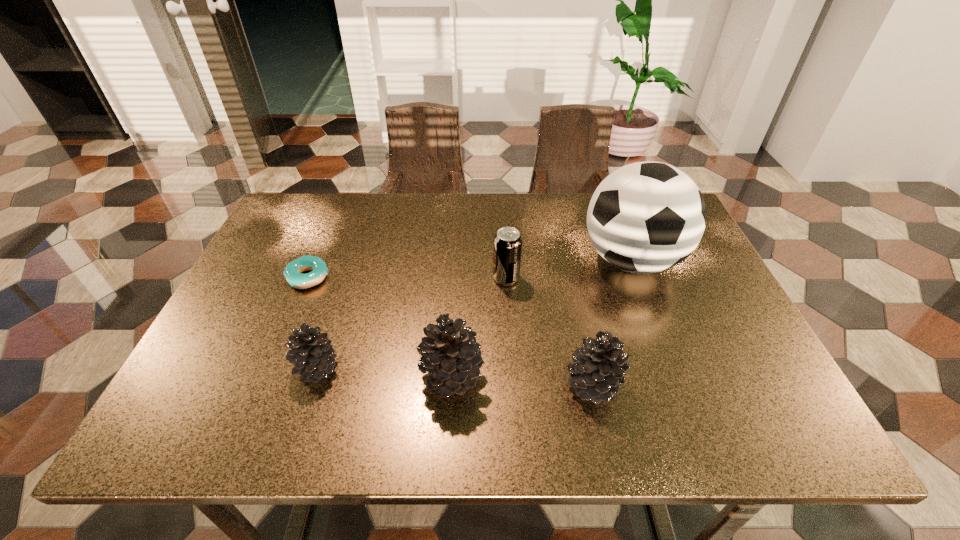
In the image, there is a desktop. Where is `vacant space at the near left corner`? vacant space at the near left corner is located at coordinates (211, 385).

The width and height of the screenshot is (960, 540). In order to click on free spot between the leftmost pinecone and the doughnut in this screenshot , I will do `click(312, 323)`.

The height and width of the screenshot is (540, 960). In order to click on free spot between the rightmost pinecone and the soda can in this screenshot , I will do `click(549, 331)`.

This screenshot has height=540, width=960. Identify the location of free spot between the doughnut and the third object from left to right. (380, 327).

Find the location of `free space between the second pinecone from left to right and the shortest pinecone`. free space between the second pinecone from left to right and the shortest pinecone is located at coordinates click(x=384, y=373).

At what (x,y) coordinates should I click in order to perform the action: click on free space between the third object from left to right and the shortest object. Please return your answer as a coordinate pair (x, y). Looking at the image, I should click on (380, 327).

Where is `vacant area between the tallest object and the second tallest pinecone`? Image resolution: width=960 pixels, height=540 pixels. vacant area between the tallest object and the second tallest pinecone is located at coordinates (612, 322).

What are the coordinates of `vacant area that lies between the second tallest pinecone and the soda can` in the screenshot? It's located at point(549,331).

Find the location of a particular element. the third closest object to the soda can is located at coordinates (598, 373).

This screenshot has width=960, height=540. In order to click on object that is the closest to the soccer ball in this screenshot , I will do `click(507, 248)`.